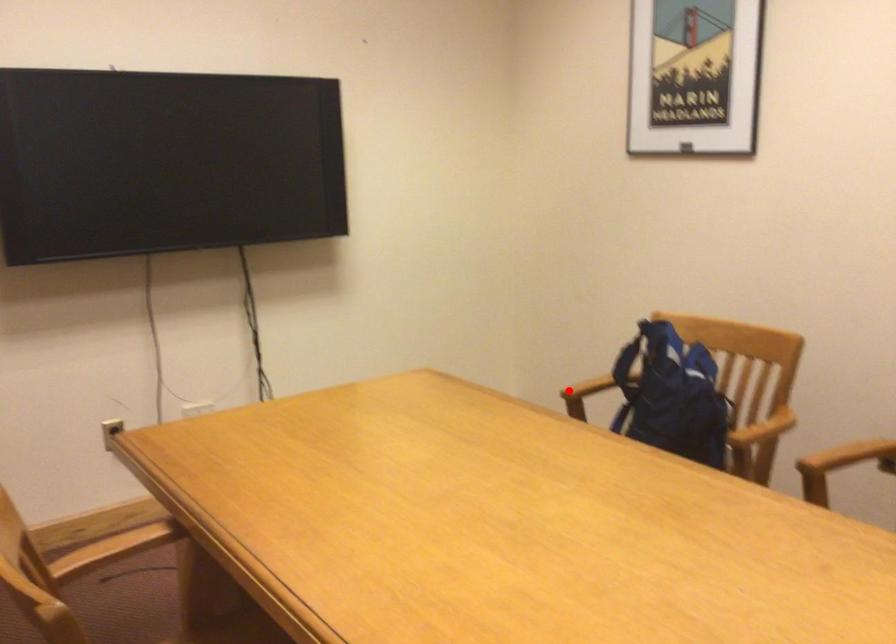
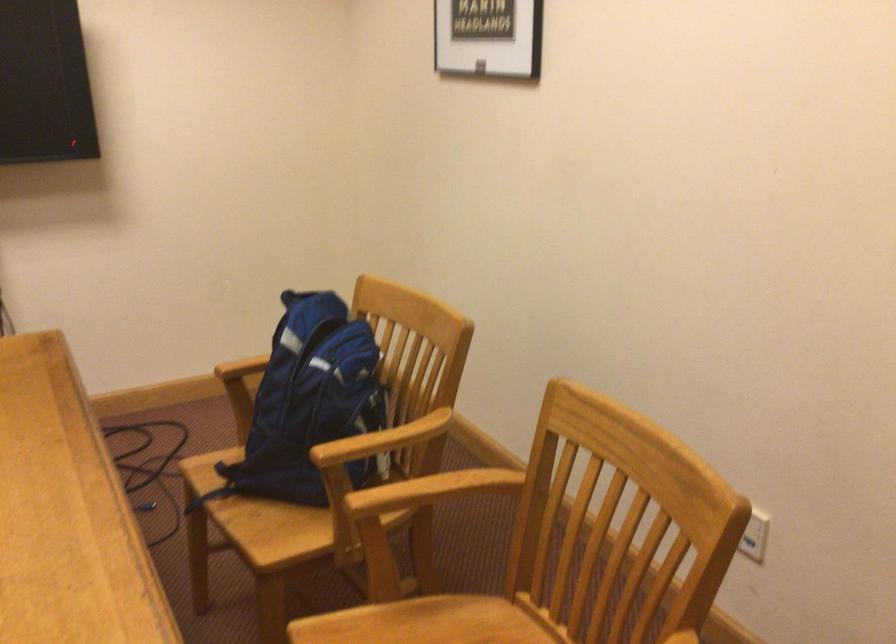
Locate, in the second image, the point that corresponds to the highlighted location in the first image.

(242, 368)